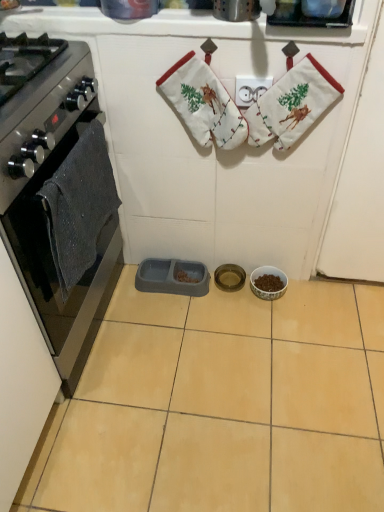
Locate an element on the screen. space that is in front of porcelain bowl at center, the third appliance in the left-to-right sequence is located at coordinates (275, 326).